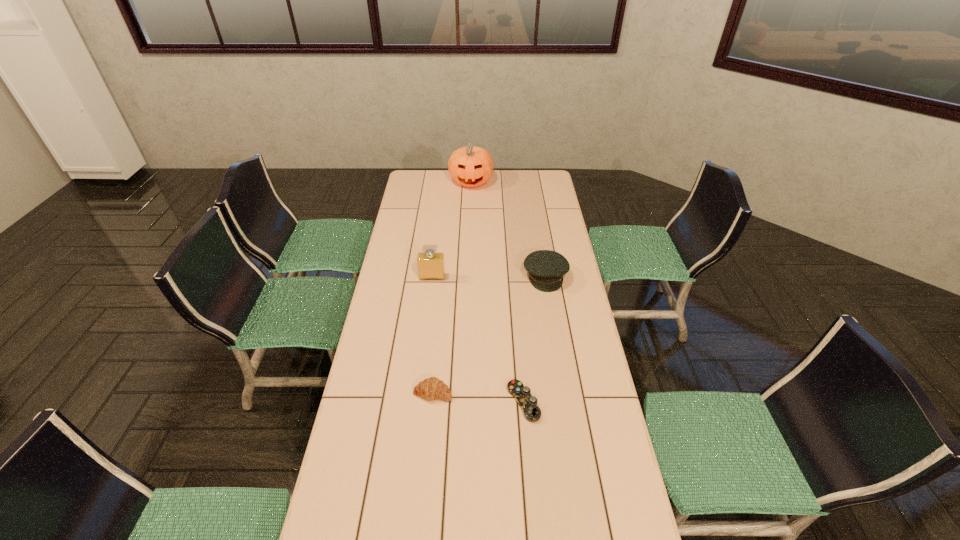
Locate an element on the screen. The image size is (960, 540). the tallest object is located at coordinates (470, 166).

Locate an element on the screen. The height and width of the screenshot is (540, 960). pumpkin is located at coordinates (470, 166).

This screenshot has width=960, height=540. Identify the location of perfume. (431, 264).

Find the location of a particular element. This screenshot has width=960, height=540. beret is located at coordinates (546, 268).

Find the location of a particular element. crescent roll is located at coordinates (432, 388).

The width and height of the screenshot is (960, 540). I want to click on control, so click(528, 403).

The image size is (960, 540). Identify the location of vacant space located on the front-facing side of the pumpkin. (469, 222).

Identify the location of free space located on the front-facing side of the fourth shortest object. This screenshot has width=960, height=540. (424, 343).

At what (x,y) coordinates should I click in order to perform the action: click on vacant area located 0.070m on the front-facing side of the third shortest object. Please return your answer as a coordinate pair (x, y). Image resolution: width=960 pixels, height=540 pixels. Looking at the image, I should click on (550, 305).

What are the coordinates of `blank area located 0.110m on the front of the fourth tallest object` in the screenshot? It's located at (429, 435).